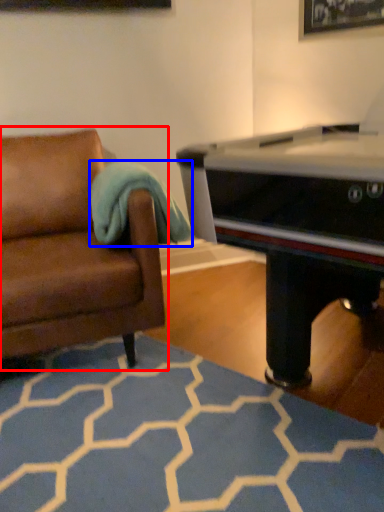
Question: Which object appears closest to the camera in this image, studio couch (highlighted by a red box) or blanket (highlighted by a blue box)?

Choices:
 (A) studio couch
 (B) blanket

Answer: (A)